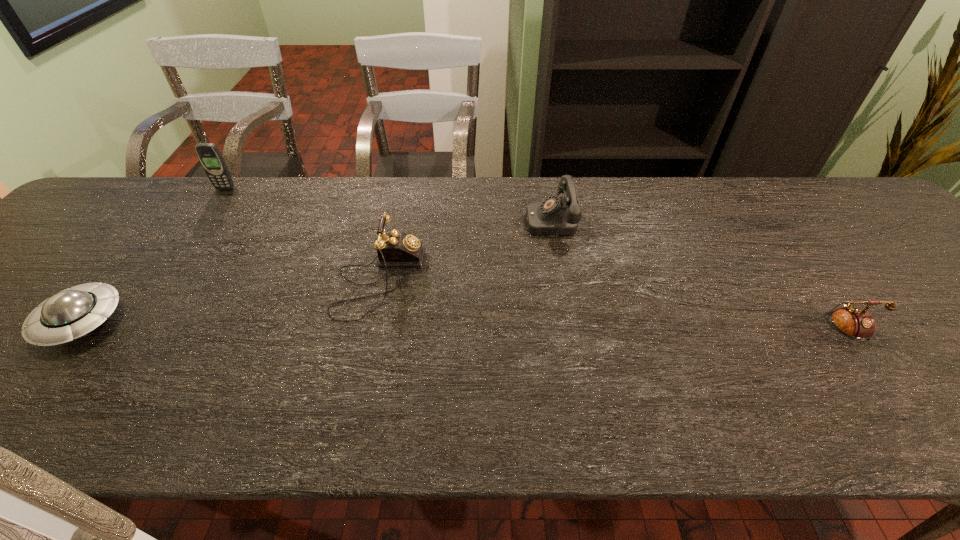
Image resolution: width=960 pixels, height=540 pixels. What are the coordinates of `vacant region located 0.120m on the dial of the farthest telephone` in the screenshot? It's located at (483, 219).

I want to click on blank space located on the dial of the farthest telephone, so click(x=440, y=219).

Locate an element on the screen. vacant space located 0.230m on the dial of the third object from right to left is located at coordinates (517, 280).

The image size is (960, 540). I want to click on free location located 0.140m on the rotary dial of the rightmost object, so click(892, 417).

Locate an element on the screen. The height and width of the screenshot is (540, 960). vacant area located 0.260m on the right of the saucer is located at coordinates (239, 321).

Identify the location of cellular telephone that is at the far edge. The height and width of the screenshot is (540, 960). (208, 154).

Image resolution: width=960 pixels, height=540 pixels. I want to click on telephone at the far edge, so click(556, 215).

This screenshot has width=960, height=540. What are the coordinates of `object that is positioned at the left edge` in the screenshot? It's located at (72, 313).

What are the coordinates of `free space at the far edge of the desktop` in the screenshot? It's located at (435, 210).

In the image, there is a desktop. Identify the location of vacant space at the near edge. (764, 411).